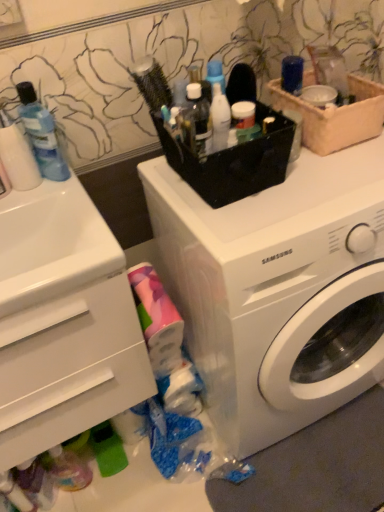
What is the approximate height of white glossy sink at left?

4.38 inches.

Where is `beige woven basket at upper right`? beige woven basket at upper right is located at coordinates (336, 116).

You are a GUI agent. You are given a task and a screenshot of the screen. Output one action in this format:
    pyautogui.click(x=<x>, y=<y>)
    Task: Click on the blue matte bottle at upper left
    The height and width of the screenshot is (512, 384).
    Given the screenshot: What is the action you would take?
    pyautogui.click(x=41, y=134)

Describe the element at coordinates (69, 368) in the screenshot. I see `white plastic drawer at lower left` at that location.

Where is `translucent plastic bottle at center, the 1th toiletry in the right-to-left sequence`? This screenshot has height=512, width=384. translucent plastic bottle at center, the 1th toiletry in the right-to-left sequence is located at coordinates (220, 118).

How different are the orientations of white glossy sink at left and translucent plastic bottle at center, the 1th toiletry in the right-to-left sequence, in degrees?

The angular difference between white glossy sink at left and translucent plastic bottle at center, the 1th toiletry in the right-to-left sequence, is 1.5 degrees.

From the image's perspective, relative to translucent plastic bottle at center, the 1th toiletry in the right-to-left sequence, is white glossy sink at left above or below?

white glossy sink at left is below translucent plastic bottle at center, the 1th toiletry in the right-to-left sequence.

Which is behind, point (37, 194) or point (220, 148)?

Point (37, 194)

Can you confirm if white plastic drawer at lower left is smaller than white glossy sink at left?

Incorrect, white plastic drawer at lower left is not smaller in size than white glossy sink at left.

In the scene shown: Between white plastic drawer at lower left and white glossy sink at left, which one has larger width?

Wider between the two is white plastic drawer at lower left.

Considering the points (67, 304) and (45, 293), which point is in front, point (67, 304) or point (45, 293)?

Point (45, 293)

Which of these two, white plastic washing machine at center or beige woven basket at upper right, is bigger?

white plastic washing machine at center is bigger.

From a real-world perspective, is white plastic washing machine at center on top of beige woven basket at upper right?

No, from a real-world perspective, white plastic washing machine at center is not above beige woven basket at upper right.

Between white plastic washing machine at center and beige woven basket at upper right, which one appears on the right side from the viewer's perspective?

From the viewer's perspective, beige woven basket at upper right appears more on the right side.

How many degrees apart are the facing directions of beige woven basket at upper right and translucent plastic bottle at center, which is counted as the second toiletry, starting from the left?

0.00278 degrees separate the facing orientations of beige woven basket at upper right and translucent plastic bottle at center, which is counted as the second toiletry, starting from the left.

Does point (341, 109) come closer to viewer compared to point (214, 139)?

That is False.

From the image's perspective, is beige woven basket at upper right on top of translucent plastic bottle at center, which is counted as the second toiletry, starting from the left?

Yes, from the image's perspective, beige woven basket at upper right is on top of translucent plastic bottle at center, which is counted as the second toiletry, starting from the left.

From a real-world perspective, between translucent plastic bottle at center, the 1th toiletry in the right-to-left sequence, and translucent plastic bottles at center, which ranks as the first toiletry in left-to-right order, who is vertically higher?

translucent plastic bottles at center, which ranks as the first toiletry in left-to-right order, from a real-world perspective.

Relative to translucent plastic bottles at center, positioned as the 2th toiletry in right-to-left order, is translucent plastic bottle at center, which is counted as the second toiletry, starting from the left, in front or behind?

In the image, translucent plastic bottle at center, which is counted as the second toiletry, starting from the left, appears behind translucent plastic bottles at center, positioned as the 2th toiletry in right-to-left order.

In the image, there is a translucent plastic bottles at center, positioned as the 2th toiletry in right-to-left order. Identify the location of toiletry below it (from a real-world perspective). The image size is (384, 512). (220, 118).

Can you confirm if translucent plastic bottle at center, the 1th toiletry in the right-to-left sequence, is shorter than translucent plastic bottles at center, positioned as the 2th toiletry in right-to-left order?

Yes.

Looking at this image, considering the sizes of objects blue matte bottle at upper left and translucent plastic bottles at center, positioned as the 2th toiletry in right-to-left order, in the image provided, who is shorter, blue matte bottle at upper left or translucent plastic bottles at center, positioned as the 2th toiletry in right-to-left order,?

Standing shorter between the two is translucent plastic bottles at center, positioned as the 2th toiletry in right-to-left order.

Considering the relative positions of blue matte bottle at upper left and translucent plastic bottles at center, which ranks as the first toiletry in left-to-right order, in the image provided, is blue matte bottle at upper left to the left or to the right of translucent plastic bottles at center, which ranks as the first toiletry in left-to-right order,?

Clearly, blue matte bottle at upper left is on the left of translucent plastic bottles at center, which ranks as the first toiletry in left-to-right order, in the image.

Is blue matte bottle at upper left looking in the opposite direction of translucent plastic bottles at center, positioned as the 2th toiletry in right-to-left order?

blue matte bottle at upper left does not have its back to translucent plastic bottles at center, positioned as the 2th toiletry in right-to-left order.

Is white plastic washing machine at center looking in the opposite direction of white plastic drawer at lower left?

No, white plastic drawer at lower left is not at the back of white plastic washing machine at center.

Does white plastic washing machine at center have a lesser height compared to white plastic drawer at lower left?

No, white plastic washing machine at center is not shorter than white plastic drawer at lower left.

In the image, there is a white plastic washing machine at center. In order to click on drawer below it (from the image's perspective) in this screenshot , I will do `click(69, 368)`.

From the image's perspective, does white plastic washing machine at center appear lower than white plastic drawer at lower left?

Actually, white plastic washing machine at center appears above white plastic drawer at lower left in the image.

In order to click on sink in front of the translucent plastic bottle at center, the 1th toiletry in the right-to-left sequence in this screenshot , I will do click(x=52, y=244).

In the image, there is a white glossy sink at left. Where is `drawer below it (from the image's perspective)`? drawer below it (from the image's perspective) is located at coordinates (69, 368).

Looking at the image, which one is located closer to white plastic drawer at lower left, translucent plastic bottles at center, which ranks as the first toiletry in left-to-right order, or white glossy sink at left?

Based on the image, white glossy sink at left appears to be nearer to white plastic drawer at lower left.

Looking at the image, which one is located closer to beige woven basket at upper right, white plastic drawer at lower left or blue matte bottle at upper left?

blue matte bottle at upper left is closer to beige woven basket at upper right.

Estimate the real-world distances between objects in this image. Which object is further from white plastic washing machine at center, translucent plastic bottles at center, which ranks as the first toiletry in left-to-right order, or beige woven basket at upper right?

Among the two, translucent plastic bottles at center, which ranks as the first toiletry in left-to-right order, is located further to white plastic washing machine at center.

Considering their positions, is white plastic washing machine at center positioned further to white glossy sink at left than blue matte bottle at upper left?

white plastic washing machine at center.

Which object lies nearer to the anchor point white plastic drawer at lower left, translucent plastic bottles at center, which ranks as the first toiletry in left-to-right order, or translucent plastic bottle at center, which is counted as the second toiletry, starting from the left?

Among the two, translucent plastic bottles at center, which ranks as the first toiletry in left-to-right order, is located nearer to white plastic drawer at lower left.

Estimate the real-world distances between objects in this image. Which object is further from translucent plastic bottle at center, the 1th toiletry in the right-to-left sequence, blue matte bottle at upper left or white plastic drawer at lower left?

white plastic drawer at lower left.

When comparing their distances from beige woven basket at upper right, does white glossy sink at left or white plastic washing machine at center seem closer?

Among the two, white plastic washing machine at center is located nearer to beige woven basket at upper right.

Considering their positions, is translucent plastic bottles at center, which ranks as the first toiletry in left-to-right order, positioned further to translucent plastic bottle at center, which is counted as the second toiletry, starting from the left, than blue matte bottle at upper left?

The object further to translucent plastic bottle at center, which is counted as the second toiletry, starting from the left, is blue matte bottle at upper left.

The image size is (384, 512). In order to click on sink between white plastic drawer at lower left and beige woven basket at upper right in the horizontal direction in this screenshot , I will do `click(52, 244)`.

The width and height of the screenshot is (384, 512). Find the location of `washing machine situated between blue matte bottle at upper left and beige woven basket at upper right from left to right`. washing machine situated between blue matte bottle at upper left and beige woven basket at upper right from left to right is located at coordinates (279, 291).

Where is `sink situated between blue matte bottle at upper left and translucent plastic bottle at center, which is counted as the second toiletry, starting from the left, from left to right`? sink situated between blue matte bottle at upper left and translucent plastic bottle at center, which is counted as the second toiletry, starting from the left, from left to right is located at coordinates (52, 244).

This screenshot has width=384, height=512. Find the location of `toiletry between translucent plastic bottles at center, positioned as the 2th toiletry in right-to-left order, and beige woven basket at upper right, in the horizontal direction`. toiletry between translucent plastic bottles at center, positioned as the 2th toiletry in right-to-left order, and beige woven basket at upper right, in the horizontal direction is located at coordinates (220, 118).